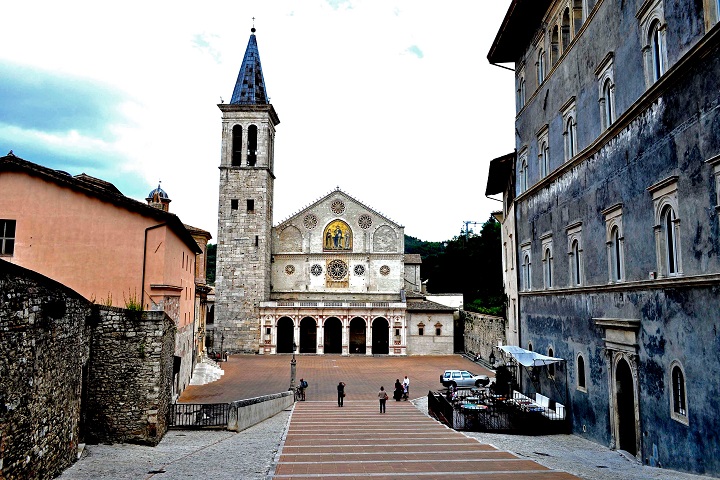
Locate an element on the screen. The width and height of the screenshot is (720, 480). 1 door on the right is located at coordinates (626, 388).